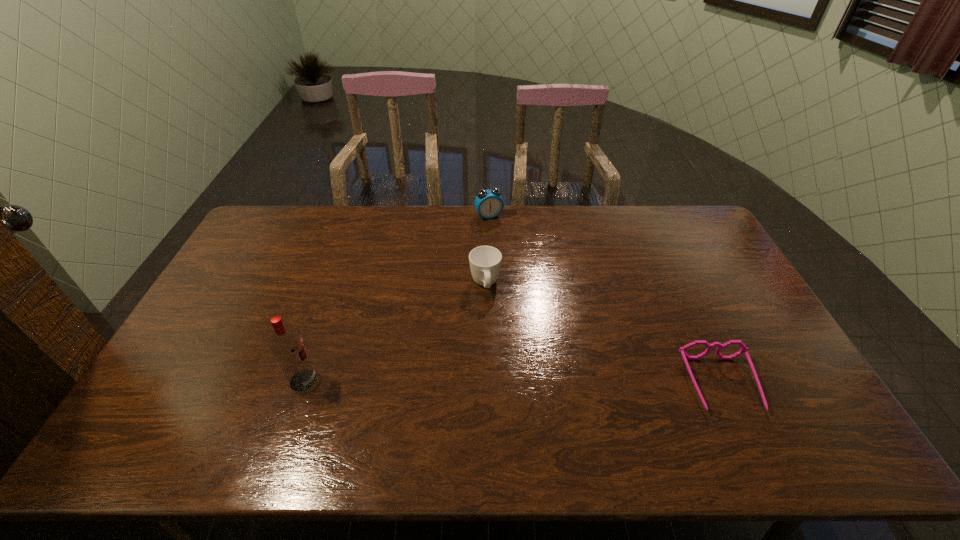
At what (x,y) coordinates should I click in order to perform the action: click on vacant space on the desktop that is between the vodka and the spectacles and is positioned with the handle on the side of the third nearest object. Please return your answer as a coordinate pair (x, y). The width and height of the screenshot is (960, 540). Looking at the image, I should click on (500, 382).

Identify the location of vacant space on the desktop that is between the tallest object and the spectacles and is positioned on the face of the alarm clock. The image size is (960, 540). (572, 383).